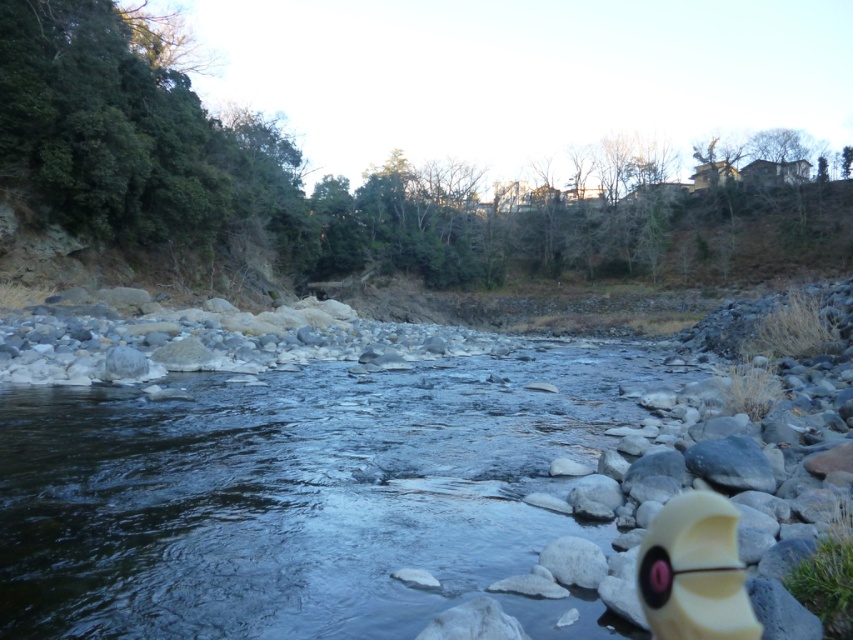
Question: Where is smooth stone stream at center located in relation to matte yellow toy at lower right in the image?

Choices:
 (A) below
 (B) above

Answer: (B)

Question: Is smooth stone stream at center positioned before matte yellow toy at lower right?

Choices:
 (A) yes
 (B) no

Answer: (B)

Question: Among these objects, which one is farthest from the camera?

Choices:
 (A) matte yellow toy at lower right
 (B) smooth stone stream at center

Answer: (B)

Question: Which point is closer to the camera taking this photo?

Choices:
 (A) (537, 513)
 (B) (701, 545)

Answer: (B)

Question: Which object appears farthest from the camera in this image?

Choices:
 (A) matte yellow toy at lower right
 (B) smooth stone stream at center

Answer: (B)

Question: Can you confirm if smooth stone stream at center is wider than matte yellow toy at lower right?

Choices:
 (A) no
 (B) yes

Answer: (B)